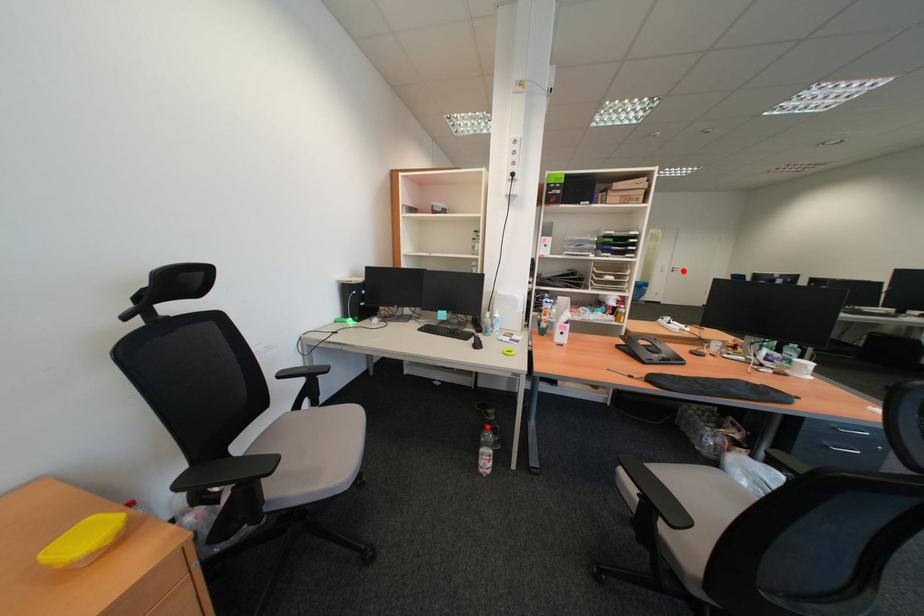
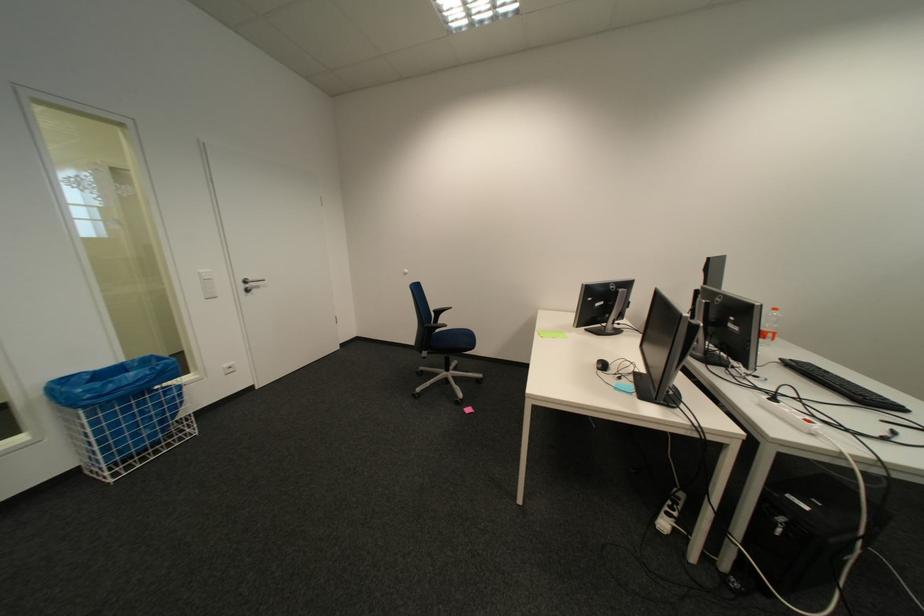
Locate, in the second image, the point that corresponds to the highlighted location in the first image.

(254, 286)